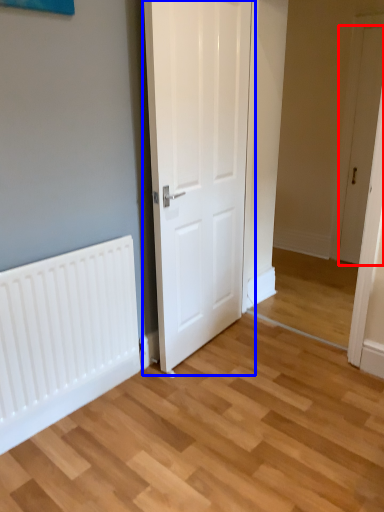
Question: Which point is closer to the camera, door (highlighted by a red box) or door (highlighted by a blue box)?

Choices:
 (A) door
 (B) door

Answer: (B)